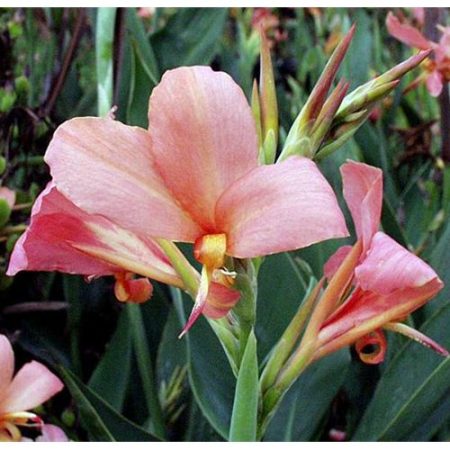
Where is `the right background plants`? The height and width of the screenshot is (450, 450). the right background plants is located at coordinates (369, 41).